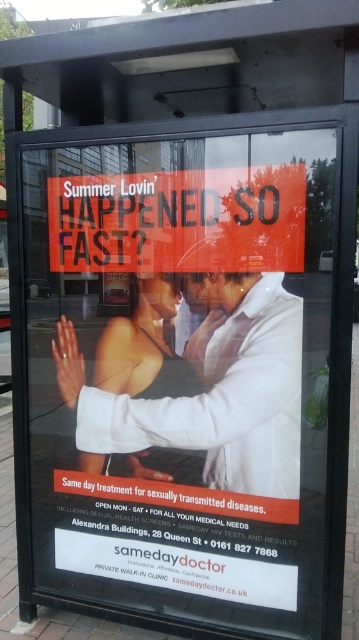
Image resolution: width=359 pixels, height=640 pixels. Find the location of `white glossy shirt at center`. white glossy shirt at center is located at coordinates (203, 381).

Is point (238, 444) farther from camera compared to point (249, 177)?

Yes, it is behind point (249, 177).

Measure the distance between white glossy shirt at center and camera.

white glossy shirt at center and camera are 6.48 feet apart.

Where is `white glossy shirt at center`? The image size is (359, 640). white glossy shirt at center is located at coordinates (203, 381).